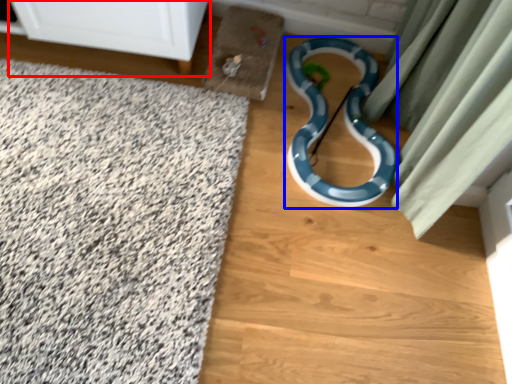
Question: Which point is further to the camera, furniture (highlighted by a red box) or snake (highlighted by a blue box)?

Choices:
 (A) furniture
 (B) snake

Answer: (B)